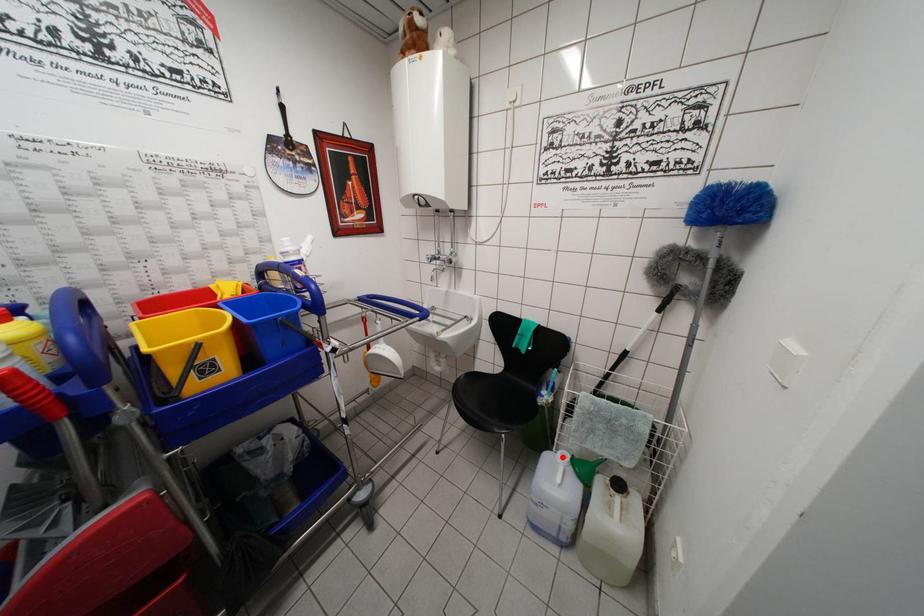
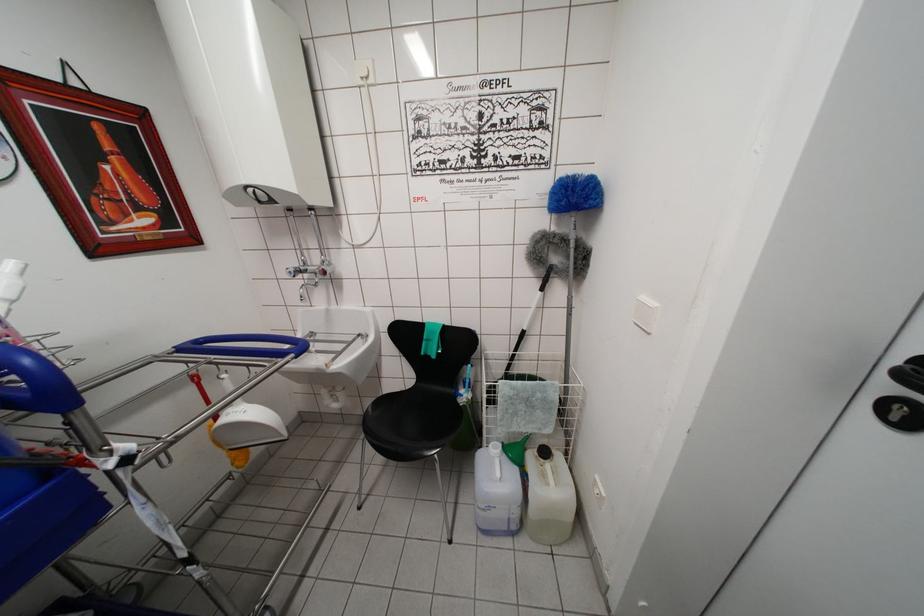
Question: I am providing you with two images of the same scene from different viewpoints. Given a red point in image1, look at the same physical point in image2. Is it:

Choices:
 (A) Closer to the viewpoint
 (B) Farther from the viewpoint

Answer: (B)